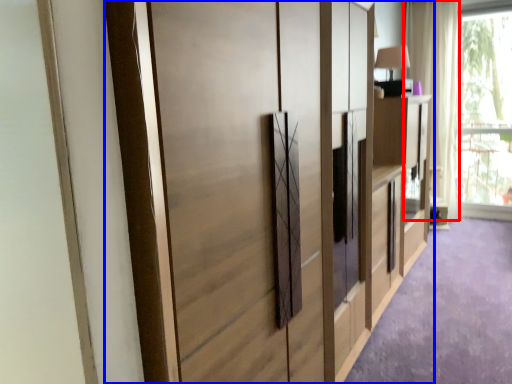
Question: Which object is further to the camera taking this photo, curtain (highlighted by a red box) or cupboard (highlighted by a blue box)?

Choices:
 (A) curtain
 (B) cupboard

Answer: (A)